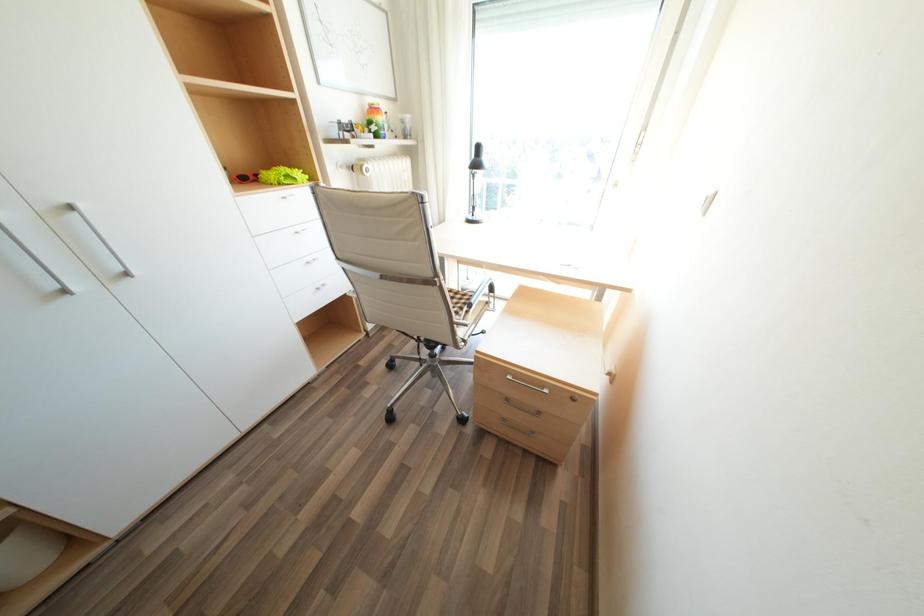
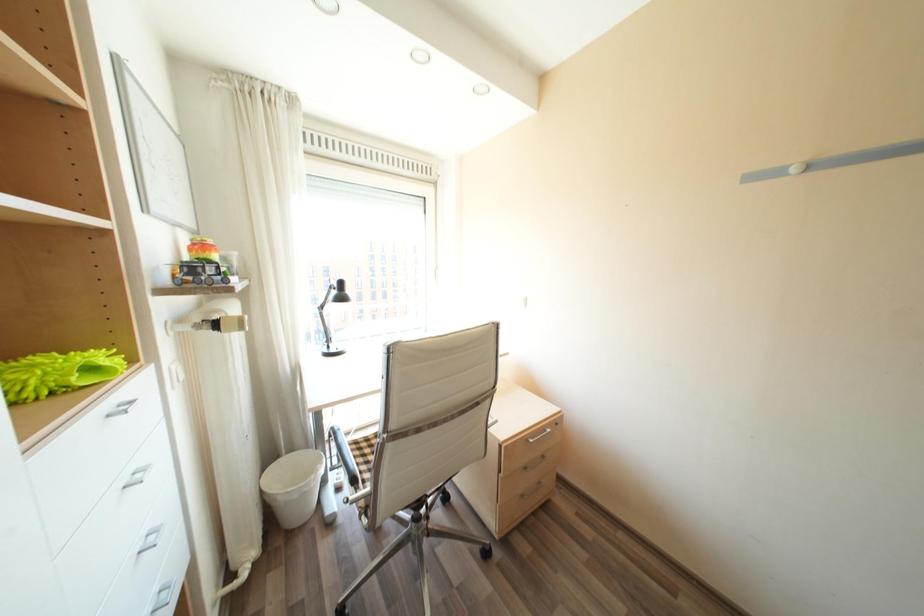
Question: Based on the continuous images, in which direction is the camera rotating? Reply with the corresponding letter.

Choices:
 (A) Left
 (B) Right
 (C) Up
 (D) Down

Answer: (B)